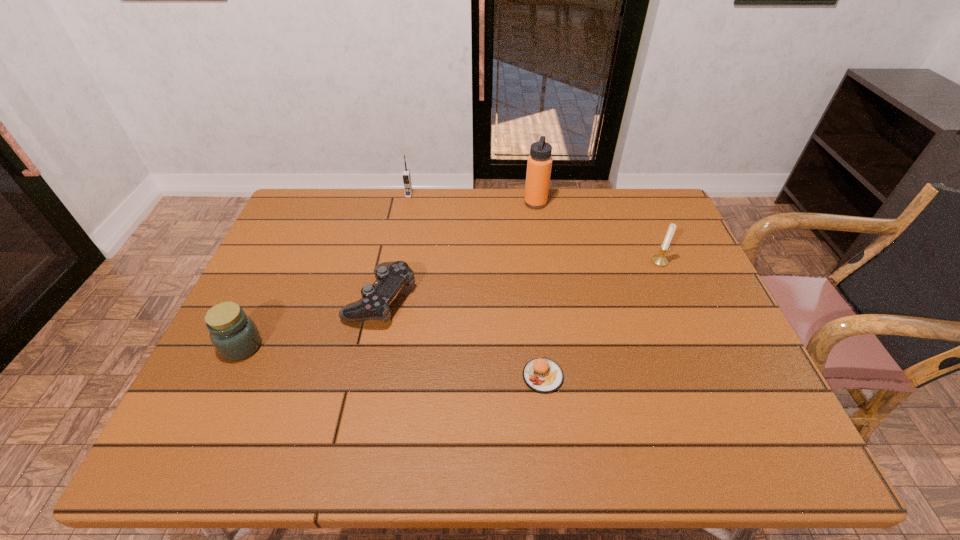
This screenshot has height=540, width=960. I want to click on the tallest object, so click(x=539, y=163).

Identify the location of cellular telephone. The height and width of the screenshot is (540, 960). (406, 176).

Where is `candle holder`? The height and width of the screenshot is (540, 960). candle holder is located at coordinates (660, 260).

Find the location of `the fourth nearest object`. the fourth nearest object is located at coordinates click(x=660, y=260).

This screenshot has height=540, width=960. In order to click on the leftmost object in this screenshot , I will do `click(235, 336)`.

Image resolution: width=960 pixels, height=540 pixels. I want to click on the second shortest object, so click(x=390, y=276).

Image resolution: width=960 pixels, height=540 pixels. In order to click on the shortest object in this screenshot , I will do `click(542, 375)`.

Find the location of a particular element. The width and height of the screenshot is (960, 540). vacant space situated 0.260m on the left of the tallest object is located at coordinates (445, 203).

This screenshot has width=960, height=540. Identify the location of vacant region located 0.200m on the front-facing side of the cellular telephone. (401, 236).

Locate an element on the screen. free location located on the front of the candle holder is located at coordinates (675, 299).